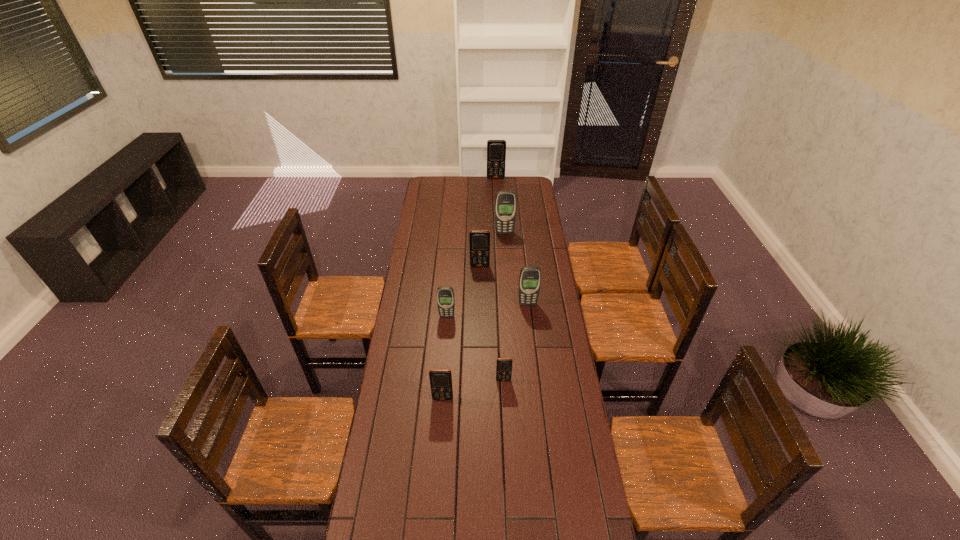
This screenshot has width=960, height=540. Find the location of `vacant region located 0.140m on the screen of the second nearest cellular telephone`. vacant region located 0.140m on the screen of the second nearest cellular telephone is located at coordinates (505, 413).

This screenshot has height=540, width=960. Identify the location of object present at the far edge. (496, 149).

This screenshot has width=960, height=540. Identify the location of object that is at the right edge. (530, 276).

In the image, there is a desktop. At what (x,y) coordinates should I click in order to perform the action: click on vacant space at the far edge. Please return your answer as a coordinate pair (x, y). Looking at the image, I should click on (465, 190).

Locate an element on the screen. This screenshot has height=540, width=960. vacant space at the left edge is located at coordinates (422, 241).

Find the location of a particular element. This screenshot has height=540, width=960. free space at the right edge of the desktop is located at coordinates (546, 262).

The image size is (960, 540). In the image, there is a desktop. In order to click on blank space at the far right corner in this screenshot , I will do `click(525, 179)`.

Identify the location of unoccupied area between the fourth farthest object and the nearest gray cellular telephone. (488, 310).

You are a GUI agent. You are given a task and a screenshot of the screen. Output one action in this format:
    pyautogui.click(x=<x>, y=<y>)
    Task: Click on the vacant space in between the third farthest orange cellular telephone and the farthest cellular telephone
    This screenshot has width=960, height=540.
    Given the screenshot: What is the action you would take?
    pyautogui.click(x=500, y=279)

Identify the location of free space between the nearest gray cellular telephone and the shortest object. (475, 348).